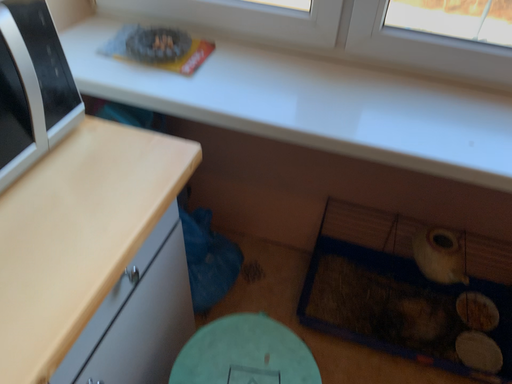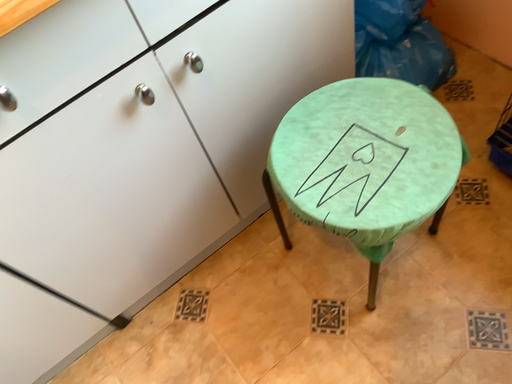
Question: How did the camera likely rotate when shooting the video?

Choices:
 (A) rotated left
 (B) rotated right

Answer: (A)